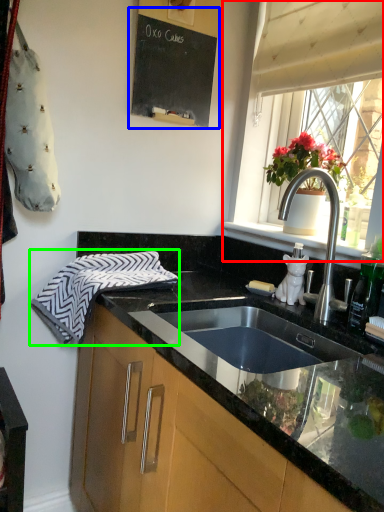
Question: Which object is positioned farthest from window (highlighted by a red box)? Select from bulletin board (highlighted by a blue box) and hand towel (highlighted by a green box).

Choices:
 (A) bulletin board
 (B) hand towel

Answer: (B)